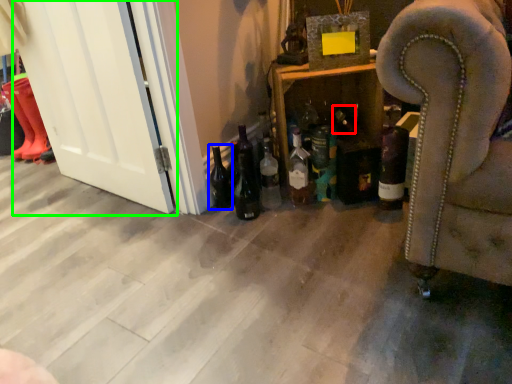
Question: Considering the real-world distances, which object is farthest from bottle (highlighted by a red box)? beer bottle (highlighted by a blue box) or screen door (highlighted by a green box)?

Choices:
 (A) beer bottle
 (B) screen door

Answer: (B)